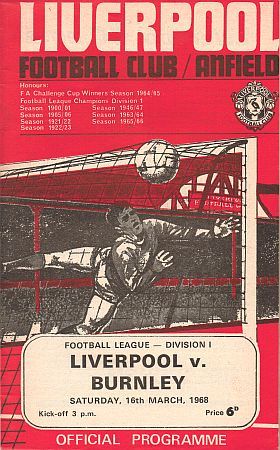
What are the coordinates of `red floor` in the screenshot? It's located at (267, 353).